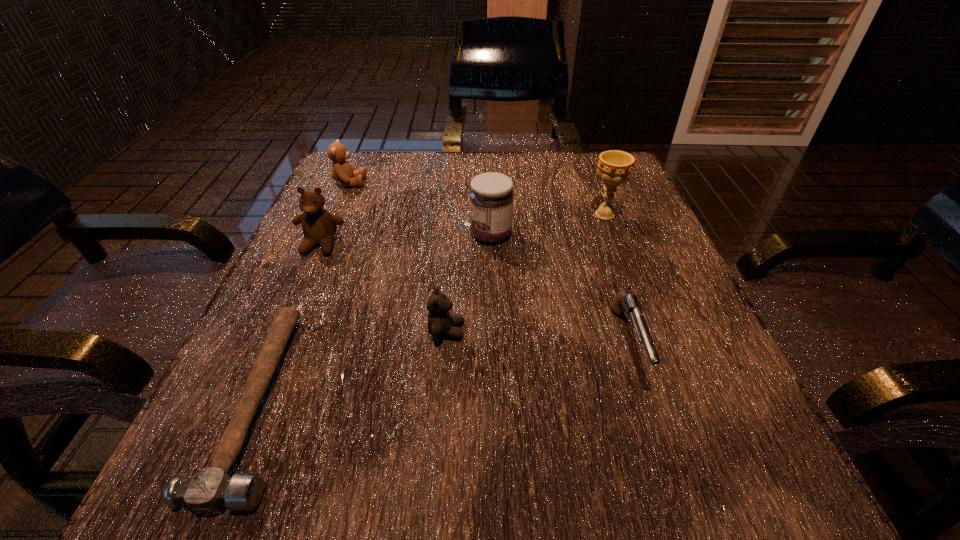
This screenshot has width=960, height=540. Identify the location of free space between the fifth object from left to right and the fourth object from right to left. (468, 283).

Locate an element on the screen. vacant point located between the fourth object from left to right and the fifth object from left to right is located at coordinates (468, 283).

At what (x,y) coordinates should I click in order to perform the action: click on vacant point located between the fourth object from right to left and the tallest teddy bear. Please return your answer as a coordinate pair (x, y). This screenshot has width=960, height=540. Looking at the image, I should click on (384, 288).

Where is `free space between the third object from right to left and the hammer`? Image resolution: width=960 pixels, height=540 pixels. free space between the third object from right to left and the hammer is located at coordinates (375, 318).

This screenshot has width=960, height=540. What are the coordinates of `free space between the chalice and the fourth object from right to left` in the screenshot? It's located at (526, 273).

Locate an element on the screen. vacant area that lies between the second shortest object and the tallest teddy bear is located at coordinates (474, 294).

The image size is (960, 540). What are the coordinates of `object that ranks as the closest to the gun` in the screenshot? It's located at (491, 196).

Locate an element on the screen. This screenshot has width=960, height=540. the closest object to the gun is located at coordinates (491, 196).

Select which teddy bear appears as the closest to the chalice. Please provide its 2D coordinates. Your answer should be formatted as a tuple, i.e. [(x, y)], where the tuple contains the x and y coordinates of a point satisfying the conditions above.

[(440, 323)]

Select which teddy bear is the closest to the nearest teddy bear. Please provide its 2D coordinates. Your answer should be formatted as a tuple, i.e. [(x, y)], where the tuple contains the x and y coordinates of a point satisfying the conditions above.

[(319, 226)]